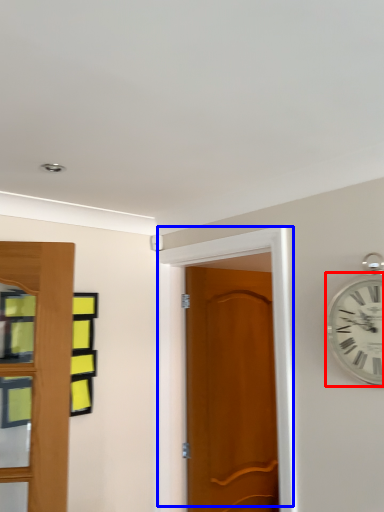
Question: Which object is further to the camera taking this photo, wall clock (highlighted by a red box) or door (highlighted by a blue box)?

Choices:
 (A) wall clock
 (B) door

Answer: (B)